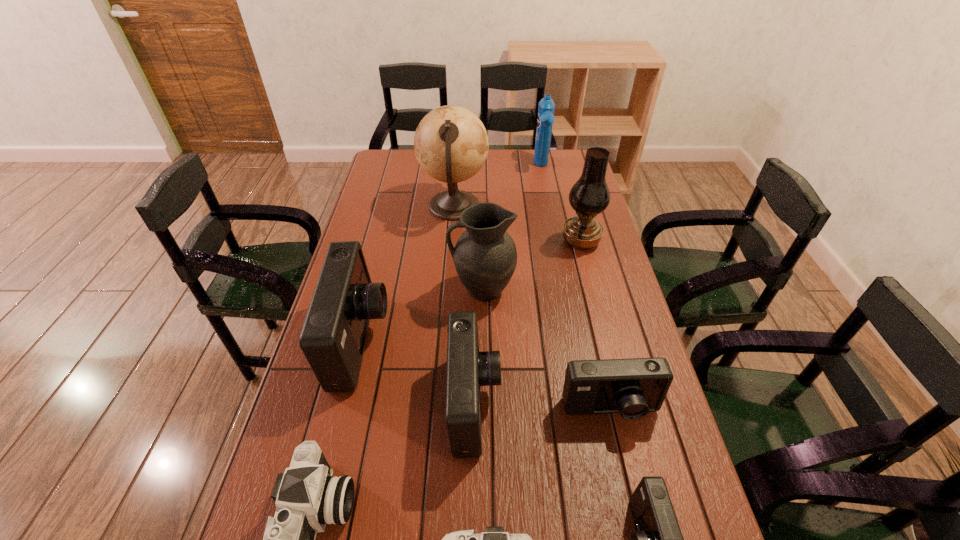
Where is `oil lamp located in the right edge section of the desktop`? The image size is (960, 540). oil lamp located in the right edge section of the desktop is located at coordinates (589, 196).

Find the location of `shampoo located at the right edge`. shampoo located at the right edge is located at coordinates (545, 119).

What are the coordinates of `camera positioned at the right edge` in the screenshot? It's located at (633, 387).

Locate an element on the screen. object located in the far right corner section of the desktop is located at coordinates point(545,119).

The height and width of the screenshot is (540, 960). Identify the location of blank space at the far edge of the desktop. (539, 168).

The width and height of the screenshot is (960, 540). Find the location of `vacant area at the left edge`. vacant area at the left edge is located at coordinates (389, 246).

I want to click on free space at the right edge, so click(613, 426).

Identify the location of unoccupied area between the tallest camera and the globe. This screenshot has height=540, width=960. (407, 274).

Find the location of a particular element. free space between the second smallest blue camera and the fifth shortest object is located at coordinates (542, 407).

The image size is (960, 540). I want to click on vacant point located between the farthest object and the third biggest blue camera, so click(x=576, y=288).